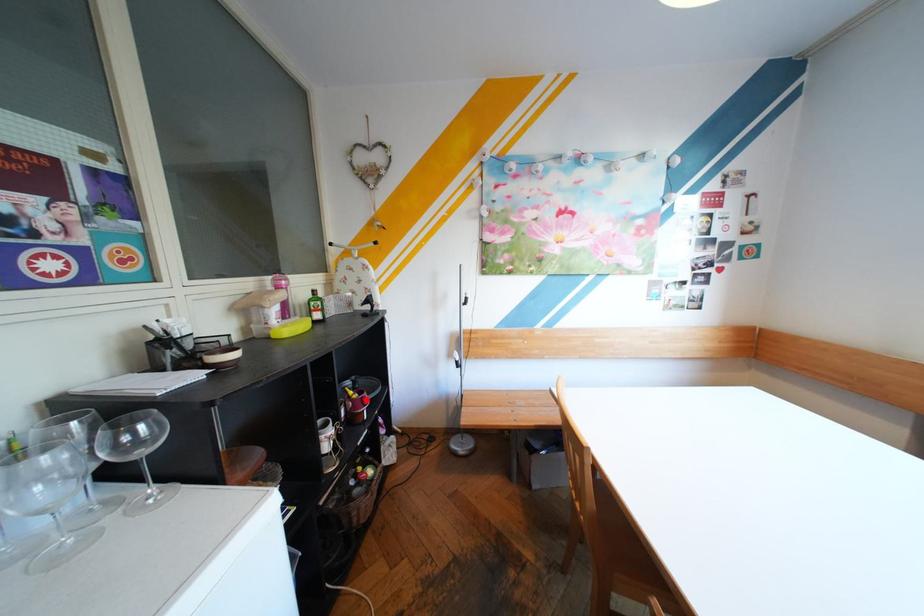
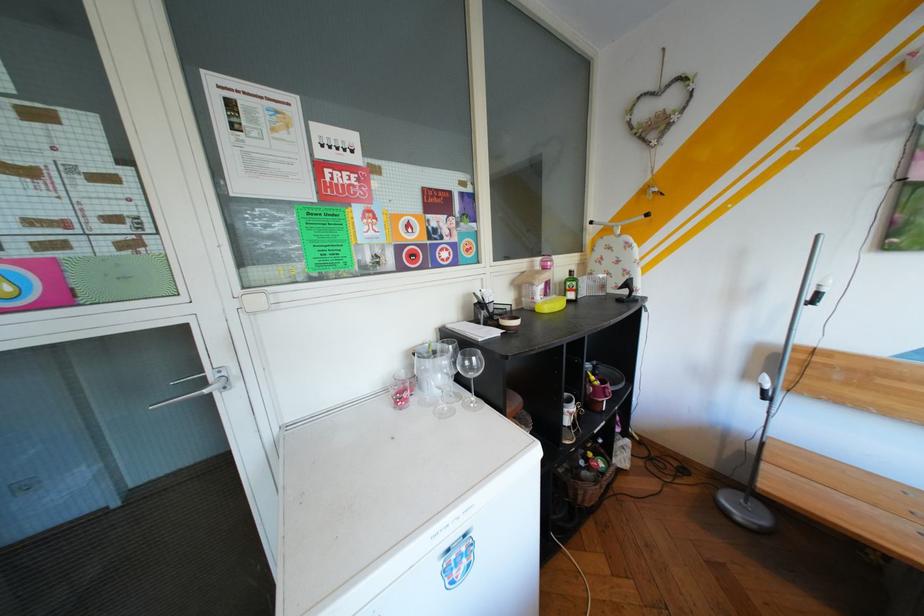
Question: I am providing you with two images of the same scene from different viewpoints. In image1, a red point is highlighted. Considering the same 3D point in image2, which of the following is correct?

Choices:
 (A) It is closer
 (B) It is farther

Answer: (B)